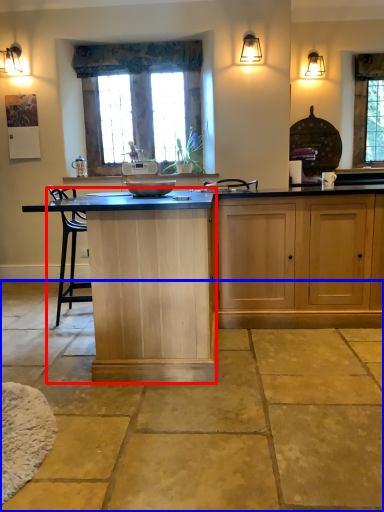
Question: Among these objects, which one is nearest to the camera, vanity (highlighted by a red box) or concrete (highlighted by a blue box)?

Choices:
 (A) vanity
 (B) concrete

Answer: (B)